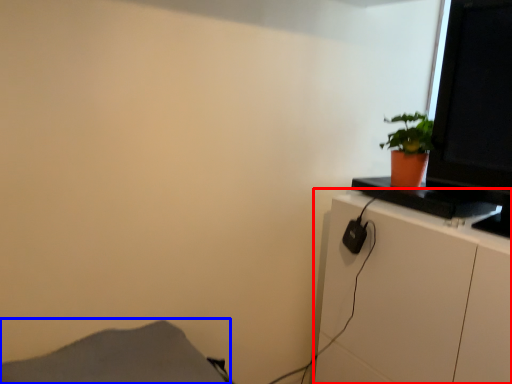
Question: Which object is further to the camera taking this photo, cabinetry (highlighted by a red box) or plain (highlighted by a blue box)?

Choices:
 (A) cabinetry
 (B) plain

Answer: (A)